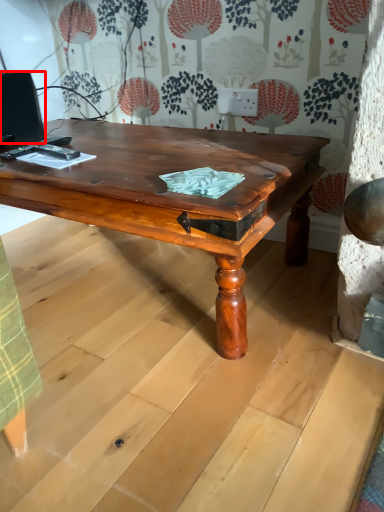
Question: From the image's perspective, where is computer monitor (annotated by the red box) located in relation to coffee table in the image?

Choices:
 (A) below
 (B) above

Answer: (B)